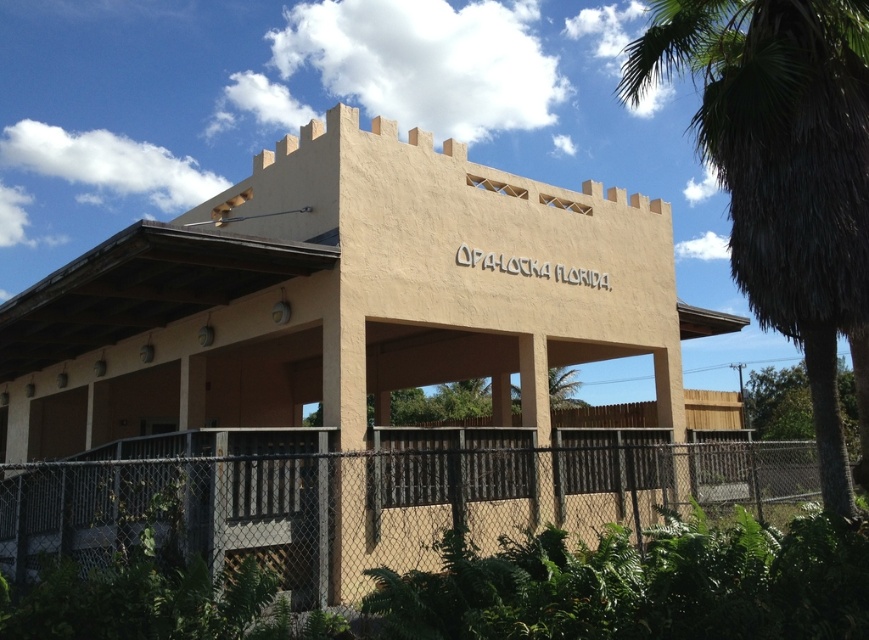
Question: Among these points, which one is farthest from the camera?

Choices:
 (A) (775, 243)
 (B) (158, 461)

Answer: (A)

Question: Does black chain-link fence at lower center appear on the right side of green leafy palm tree at right?

Choices:
 (A) yes
 (B) no

Answer: (B)

Question: Which point is farther from the camera taking this photo?

Choices:
 (A) (807, 154)
 (B) (367, 497)

Answer: (B)

Question: From the image, what is the correct spatial relationship of black chain-link fence at lower center in relation to green leafy palm tree at right?

Choices:
 (A) above
 (B) below

Answer: (B)

Question: Does black chain-link fence at lower center have a smaller size compared to green leafy palm tree at right?

Choices:
 (A) yes
 (B) no

Answer: (A)